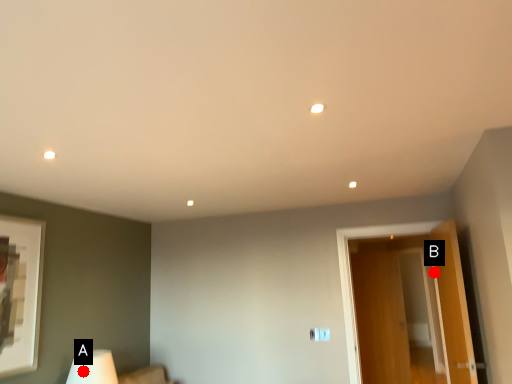
Question: Two points are circled on the image, labeled by A and B beside each circle. Which point is farther to the camera?

Choices:
 (A) A is further
 (B) B is further

Answer: (B)